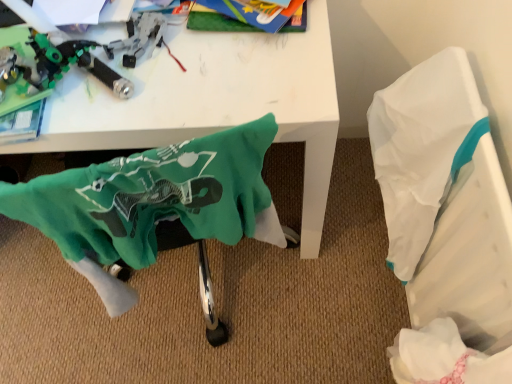
Question: Is white glossy table at upper center closer to the viewer compared to white paper at right?

Choices:
 (A) yes
 (B) no

Answer: (A)

Question: Considering the relative positions of white glossy table at upper center and white paper at right in the image provided, is white glossy table at upper center behind white paper at right?

Choices:
 (A) no
 (B) yes

Answer: (A)

Question: From a real-world perspective, is white glossy table at upper center on top of white paper at right?

Choices:
 (A) no
 (B) yes

Answer: (B)

Question: From a real-world perspective, is white glossy table at upper center physically below white paper at right?

Choices:
 (A) yes
 (B) no

Answer: (B)

Question: Can you confirm if white glossy table at upper center is wider than white paper at right?

Choices:
 (A) no
 (B) yes

Answer: (B)

Question: In terms of width, does green fabric swivel chair at lower left look wider or thinner when compared to white glossy table at upper center?

Choices:
 (A) thin
 (B) wide

Answer: (A)

Question: Is green fabric swivel chair at lower left in front of or behind white glossy table at upper center in the image?

Choices:
 (A) behind
 (B) front

Answer: (B)

Question: In terms of height, does green fabric swivel chair at lower left look taller or shorter compared to white glossy table at upper center?

Choices:
 (A) tall
 (B) short

Answer: (B)

Question: Is green fabric swivel chair at lower left bigger or smaller than white glossy table at upper center?

Choices:
 (A) big
 (B) small

Answer: (B)

Question: Is point (42, 72) positioned closer to the camera than point (274, 243)?

Choices:
 (A) farther
 (B) closer

Answer: (B)

Question: From a real-world perspective, is translucent plastic toy gun at upper left physically located above or below green fabric swivel chair at lower left?

Choices:
 (A) below
 (B) above

Answer: (B)

Question: Based on their sizes in the image, would you say translucent plastic toy gun at upper left is bigger or smaller than green fabric swivel chair at lower left?

Choices:
 (A) big
 (B) small

Answer: (B)

Question: Is translucent plastic toy gun at upper left to the left or to the right of green fabric swivel chair at lower left in the image?

Choices:
 (A) left
 (B) right

Answer: (A)

Question: Which is correct: white paper at right is inside white glossy table at upper center, or outside of it?

Choices:
 (A) inside
 (B) outside

Answer: (B)

Question: Does point (440, 301) appear closer or farther from the camera than point (8, 145)?

Choices:
 (A) closer
 (B) farther

Answer: (B)